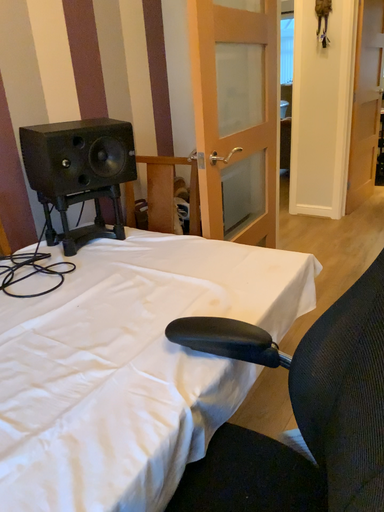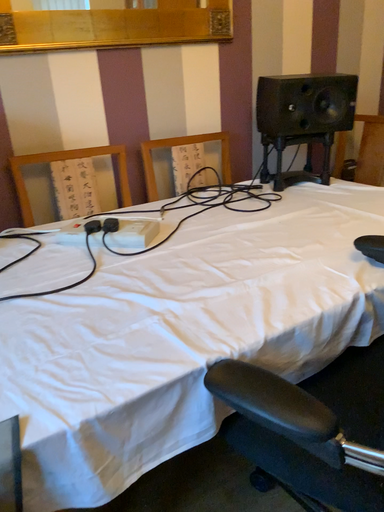
Question: Which way did the camera rotate in the video?

Choices:
 (A) rotated right
 (B) rotated left

Answer: (B)